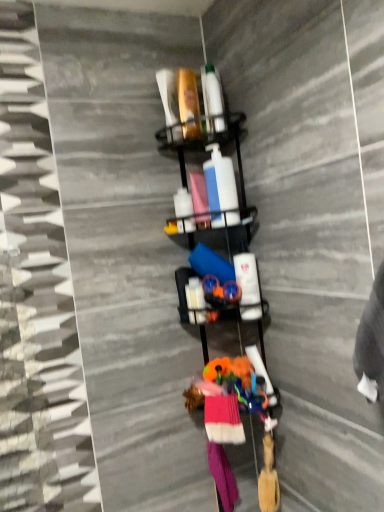
Question: Is metallic black shelf at center positioned far away from pink fabric socks at lower center, the 2th clothing viewed from the top?

Choices:
 (A) yes
 (B) no

Answer: (B)

Question: Can you confirm if metallic black shelf at center is shorter than pink fabric socks at lower center, which is counted as the first clothing, starting from the back?

Choices:
 (A) yes
 (B) no

Answer: (B)

Question: Is metallic black shelf at center looking in the opposite direction of pink fabric socks at lower center, the second clothing from the front?

Choices:
 (A) no
 (B) yes

Answer: (A)

Question: Considering the relative positions of metallic black shelf at center and pink fabric socks at lower center, which is counted as the first clothing, starting from the back, in the image provided, is metallic black shelf at center to the left of pink fabric socks at lower center, which is counted as the first clothing, starting from the back, from the viewer's perspective?

Choices:
 (A) yes
 (B) no

Answer: (A)

Question: From the image's perspective, would you say metallic black shelf at center is positioned over pink fabric socks at lower center, the 2th clothing viewed from the top?

Choices:
 (A) yes
 (B) no

Answer: (A)

Question: From a real-world perspective, is metallic black shelf at center located higher than pink fabric socks at lower center, the second clothing from the front?

Choices:
 (A) no
 (B) yes

Answer: (B)

Question: Considering the relative positions of knitted wool socks at center, the 2th clothing positioned from the back, and pink fabric socks at lower center, the second clothing from the front, in the image provided, is knitted wool socks at center, the 2th clothing positioned from the back, to the right of pink fabric socks at lower center, the second clothing from the front, from the viewer's perspective?

Choices:
 (A) no
 (B) yes

Answer: (A)

Question: Does knitted wool socks at center, placed as the first clothing when sorted from top to bottom, come behind pink fabric socks at lower center, the second clothing from the front?

Choices:
 (A) yes
 (B) no

Answer: (B)

Question: Is knitted wool socks at center, which is the 1th clothing from front to back, not close to pink fabric socks at lower center, which is counted as the first clothing, starting from the back?

Choices:
 (A) no
 (B) yes

Answer: (A)

Question: Are knitted wool socks at center, positioned as the 2th clothing in bottom-to-top order, and pink fabric socks at lower center, which is counted as the first clothing, starting from the back, making contact?

Choices:
 (A) yes
 (B) no

Answer: (B)

Question: Is knitted wool socks at center, which is the 1th clothing from front to back, smaller than pink fabric socks at lower center, which is counted as the first clothing, starting from the back?

Choices:
 (A) no
 (B) yes

Answer: (B)

Question: Is knitted wool socks at center, placed as the first clothing when sorted from top to bottom, at the left side of pink fabric socks at lower center, the second clothing from the front?

Choices:
 (A) yes
 (B) no

Answer: (A)

Question: From a real-world perspective, does metallic black shelf at center sit lower than knitted wool socks at center, placed as the first clothing when sorted from top to bottom?

Choices:
 (A) no
 (B) yes

Answer: (A)